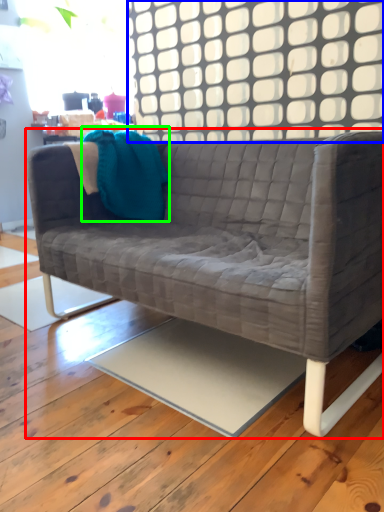
Question: Which object is the farthest from studio couch (highlighted by a red box)? Choose among these: window (highlighted by a blue box) or throw pillow (highlighted by a green box).

Choices:
 (A) window
 (B) throw pillow

Answer: (A)